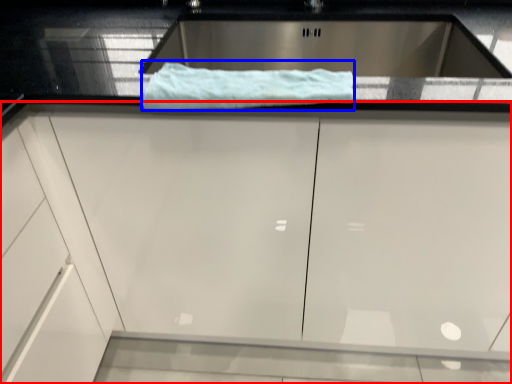
Question: Which of the following is the farthest to the observer, cabinetry (highlighted by a red box) or bath towel (highlighted by a blue box)?

Choices:
 (A) cabinetry
 (B) bath towel

Answer: (B)